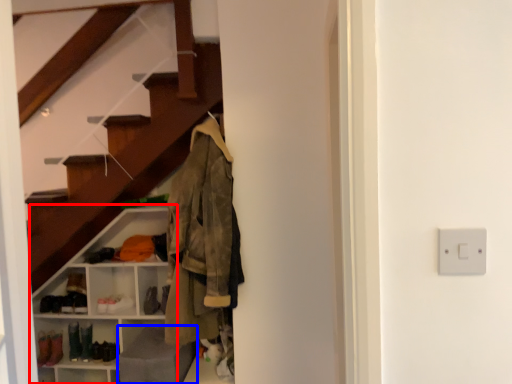
Question: Which of the following is the farthest to the observer, shelf (highlighted by a red box) or gray (highlighted by a blue box)?

Choices:
 (A) shelf
 (B) gray

Answer: (A)